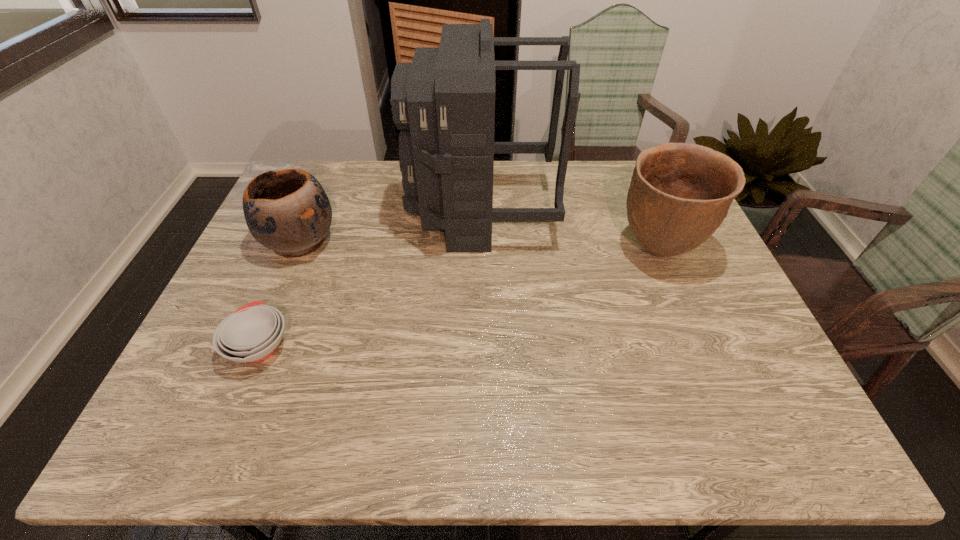
Where is `free spot located on the front compartment of the backpack`? The width and height of the screenshot is (960, 540). free spot located on the front compartment of the backpack is located at coordinates (339, 212).

At what (x,y) coordinates should I click in order to perform the action: click on vacant space located 0.240m on the left of the right pottery. Please return your answer as a coordinate pair (x, y). Looking at the image, I should click on (529, 250).

This screenshot has width=960, height=540. Identify the location of vacant space located on the right of the left pottery. (367, 241).

Where is `free location located on the front of the shortest object`? This screenshot has width=960, height=540. free location located on the front of the shortest object is located at coordinates (227, 424).

Where is `object that is at the far edge`? This screenshot has height=540, width=960. object that is at the far edge is located at coordinates (444, 101).

You are a GUI agent. You are given a task and a screenshot of the screen. Output one action in this format:
    pyautogui.click(x=<x>, y=<y>)
    Task: Click on the pottery located at the left edge
    This screenshot has height=540, width=960.
    Given the screenshot: What is the action you would take?
    pyautogui.click(x=287, y=211)

Locate an element on the screen. The image size is (960, 540). soup bowl that is at the left edge is located at coordinates [252, 333].

Locate an element on the screen. The width and height of the screenshot is (960, 540). object that is at the right edge is located at coordinates (680, 193).

This screenshot has height=540, width=960. What are the coordinates of `blank space at the far edge of the desktop` in the screenshot? It's located at pyautogui.click(x=352, y=187).

At what (x,y) coordinates should I click in order to perform the action: click on vacant space at the near edge. Please return your answer as a coordinate pair (x, y). Image resolution: width=960 pixels, height=540 pixels. Looking at the image, I should click on (606, 447).